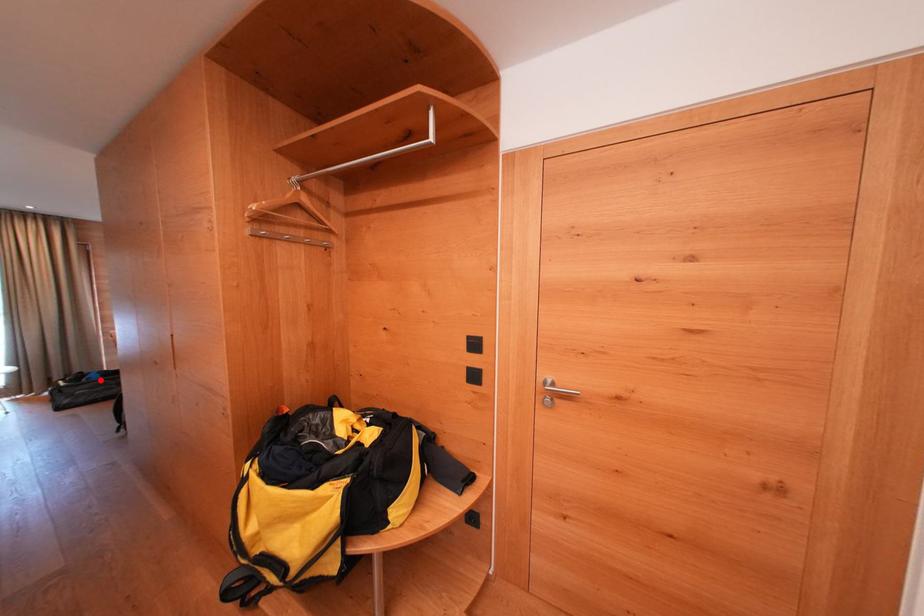
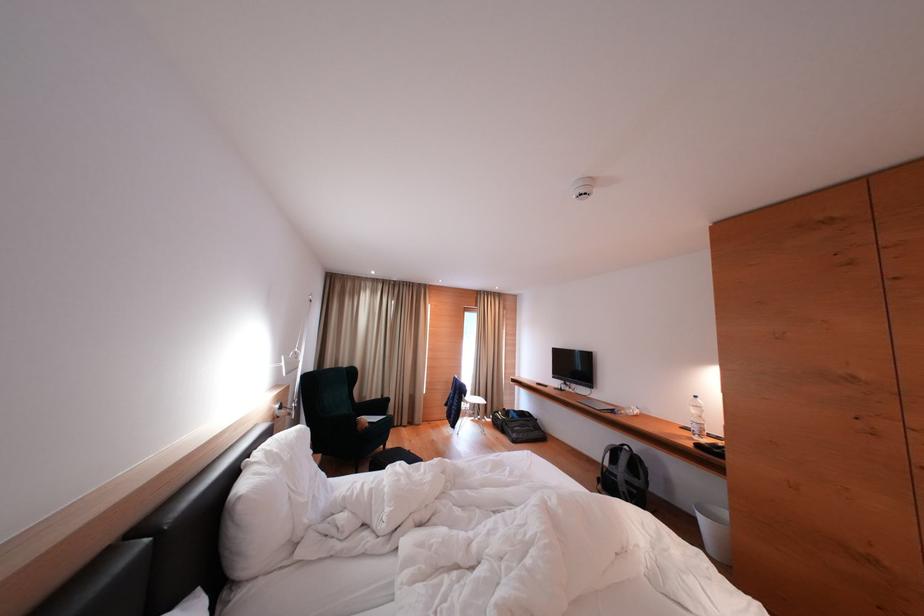
The point at the highlighted location is marked in the first image. Where is the corresponding point in the second image?

(518, 418)